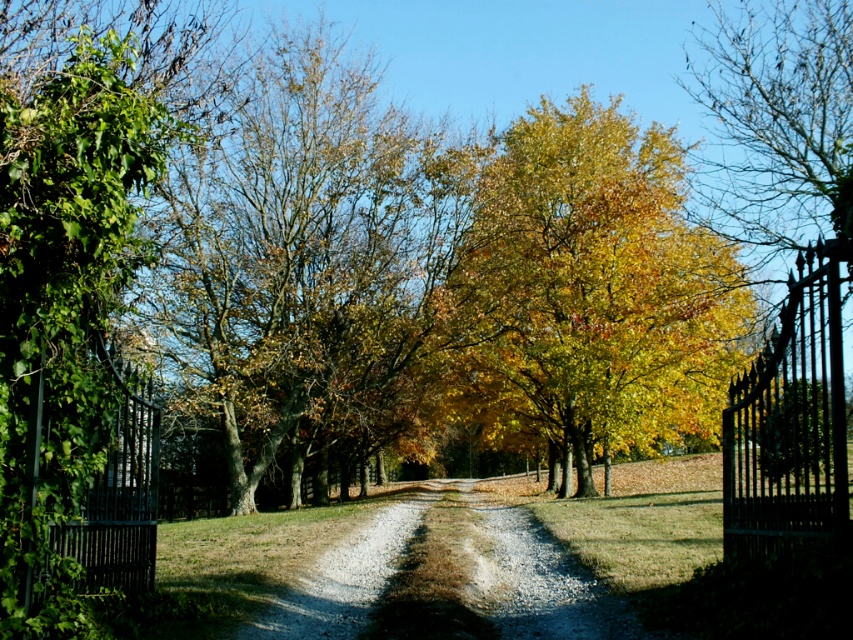
You are standing at the starting point of the gravel path and want to reach the green leafy tree at center. Which direction should you walk to reach it?

The green leafy tree at center is located at coordinates 0.403 on the x axis and 0.356 on the y axis, so you should walk forward along the gravel path towards the center of the image to reach it.